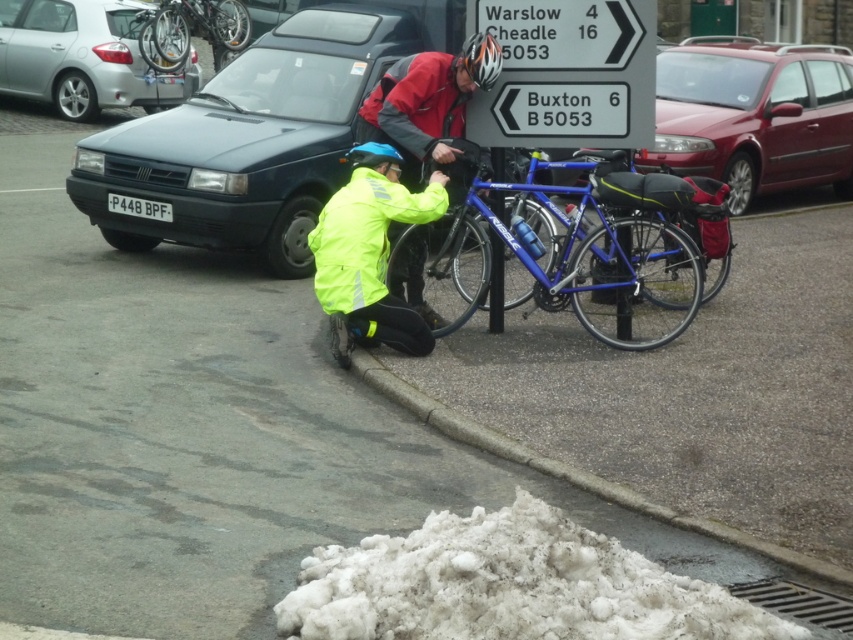
Is silver metallic car at upper left in front of shiny metallic bicycle at upper left?

No.

Can you confirm if silver metallic car at upper left is positioned above shiny metallic bicycle at upper left?

No, silver metallic car at upper left is not above shiny metallic bicycle at upper left.

Between point (3, 54) and point (244, 33), which one is positioned behind?

Positioned behind is point (244, 33).

Where is `silver metallic car at upper left`? silver metallic car at upper left is located at coordinates [84, 58].

Between matte black car at left and neon yellow jacket at lower center, which one is positioned higher?

Positioned higher is matte black car at left.

Who is positioned more to the left, matte black car at left or neon yellow jacket at lower center?

matte black car at left

Image resolution: width=853 pixels, height=640 pixels. Find the location of `matte black car at left`. matte black car at left is located at coordinates (247, 141).

Is metallic red car at right taller than shiny metallic bicycle at upper left?

Correct, metallic red car at right is much taller as shiny metallic bicycle at upper left.

Who is positioned more to the left, metallic red car at right or shiny metallic bicycle at upper left?

shiny metallic bicycle at upper left

This screenshot has width=853, height=640. Describe the element at coordinates (753, 116) in the screenshot. I see `metallic red car at right` at that location.

Find the location of `metallic red car at right`. metallic red car at right is located at coordinates (753, 116).